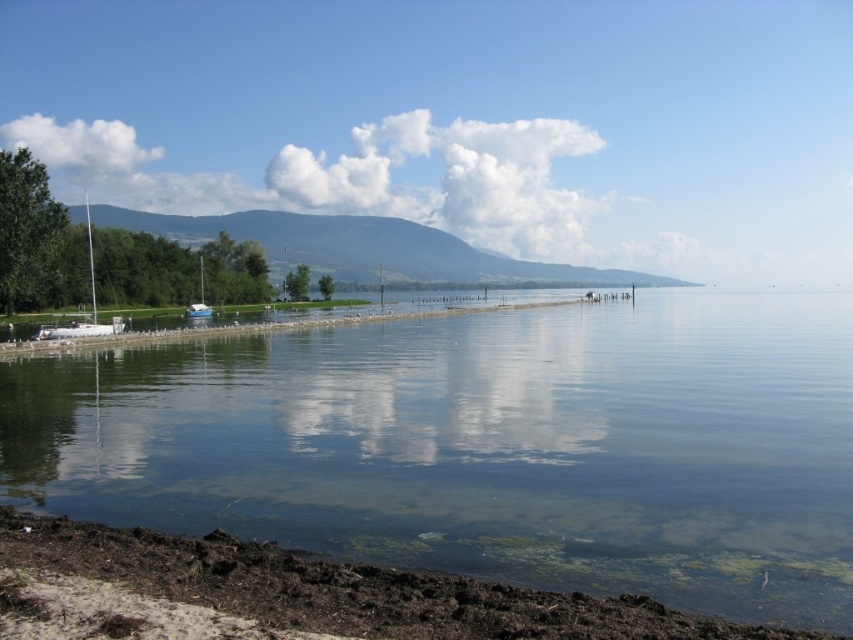
Question: Does clear water at lower left appear on the right side of brown dirt at lower left?

Choices:
 (A) yes
 (B) no

Answer: (A)

Question: Can you confirm if clear water at lower left is positioned below white glossy sailboat at center-left?

Choices:
 (A) no
 (B) yes

Answer: (B)

Question: Can you confirm if brown dirt at lower left is bigger than white glossy sailboat at center-left?

Choices:
 (A) no
 (B) yes

Answer: (A)

Question: Which object appears closest to the camera in this image?

Choices:
 (A) white glossy sailboat at center-left
 (B) brown dirt at lower left
 (C) white matte sailboat at left
 (D) clear water at lower left

Answer: (B)

Question: Which point is closer to the camera?

Choices:
 (A) (111, 360)
 (B) (202, 310)
 (C) (392, 616)
 (D) (39, 337)

Answer: (C)

Question: Based on their relative distances, which object is nearer to the white matte sailboat at left?

Choices:
 (A) clear water at lower left
 (B) brown dirt at lower left

Answer: (A)